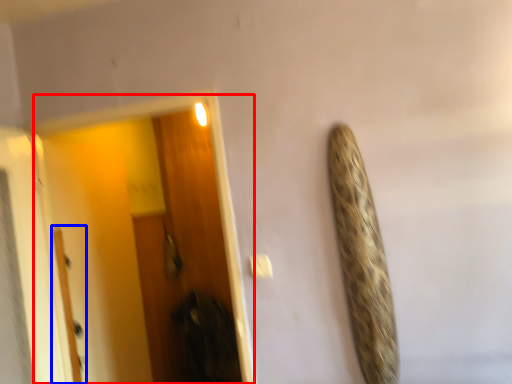
Question: Which point is closer to the camera, screen door (highlighted by a red box) or door (highlighted by a blue box)?

Choices:
 (A) screen door
 (B) door

Answer: (A)